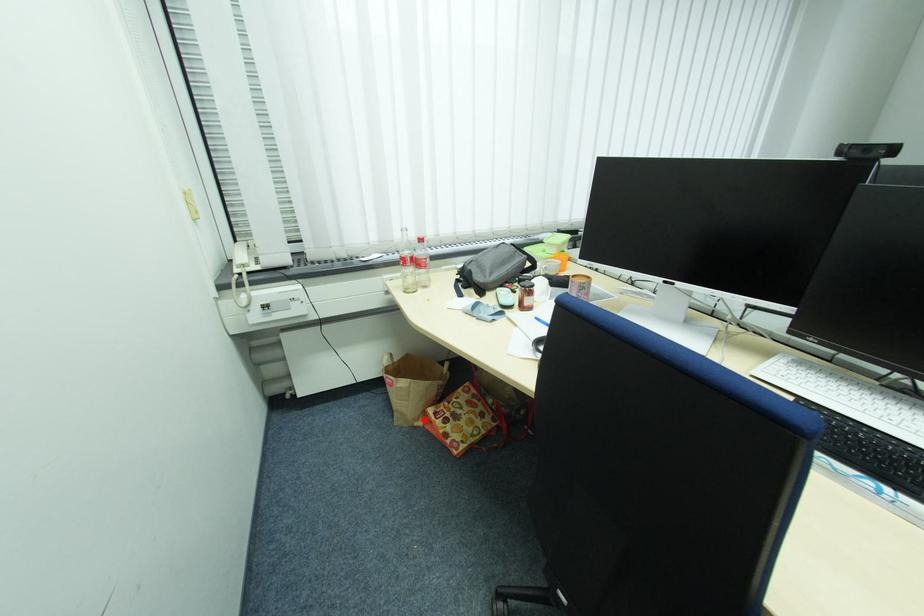
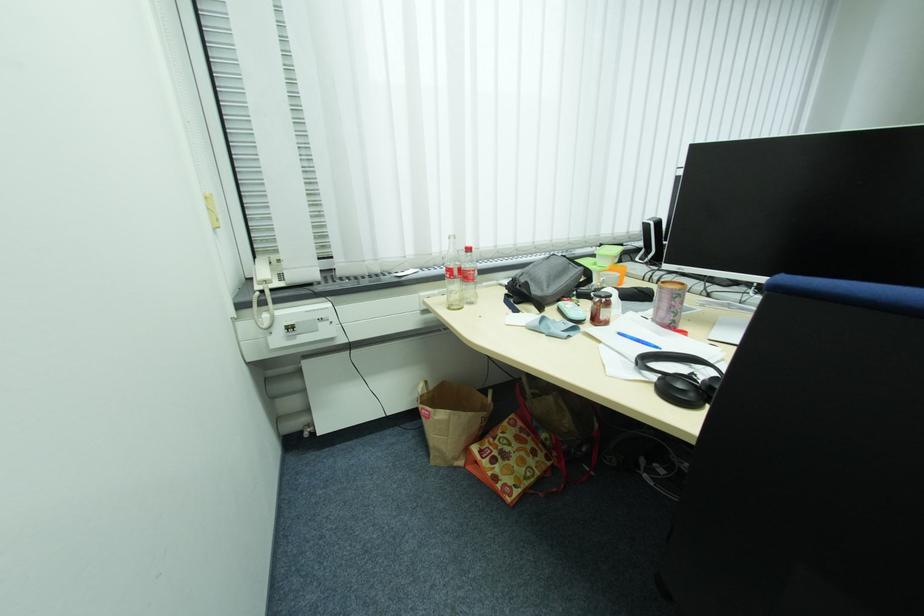
Question: I am providing you with two images of the same scene from different viewpoints. Image1 has a red point marked. In image2, the corresponding 3D location appears at what relative position? Reply with the corresponding letter.

Choices:
 (A) Closer
 (B) Farther

Answer: (B)